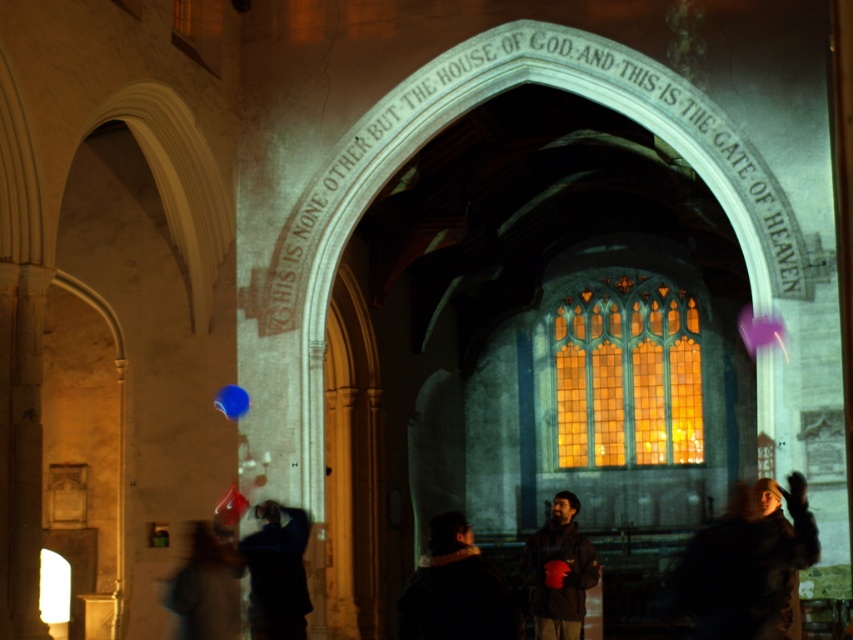
Between dark fabric jacket at lower center and dark brown leather jacket at center, which one is positioned lower?

dark brown leather jacket at center is lower down.

Does point (440, 625) lie in front of point (550, 528)?

That is True.

The width and height of the screenshot is (853, 640). I want to click on dark fabric jacket at lower center, so click(456, 589).

Is dark brown leather jacket at center positioned before blue rubber balloon at lower left?

Yes, it is in front of blue rubber balloon at lower left.

Is dark brown leather jacket at center positioned at the back of blue rubber balloon at lower left?

That is False.

This screenshot has width=853, height=640. I want to click on dark brown leather jacket at center, so click(x=560, y=557).

This screenshot has width=853, height=640. Identify the location of dark brown leather jacket at center. (560, 557).

Is dark fabric jacket at center below rubber balloon at lower center?

No, dark fabric jacket at center is not below rubber balloon at lower center.

From the picture: Is dark fabric jacket at center thinner than rubber balloon at lower center?

Incorrect, dark fabric jacket at center's width is not less than rubber balloon at lower center's.

Image resolution: width=853 pixels, height=640 pixels. I want to click on dark fabric jacket at center, so click(276, 573).

The image size is (853, 640). I want to click on dark fabric jacket at center, so pos(276,573).